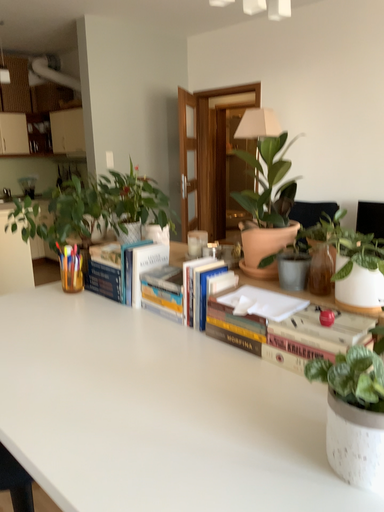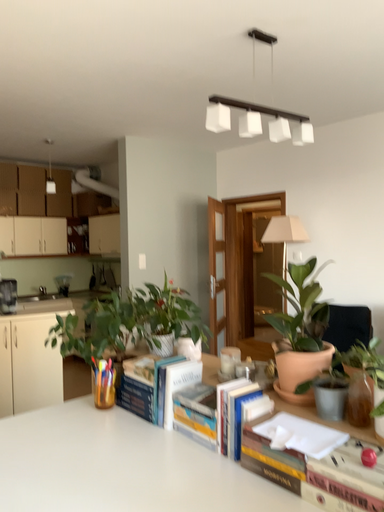
Question: How did the camera likely rotate when shooting the video?

Choices:
 (A) rotated upward
 (B) rotated downward

Answer: (A)